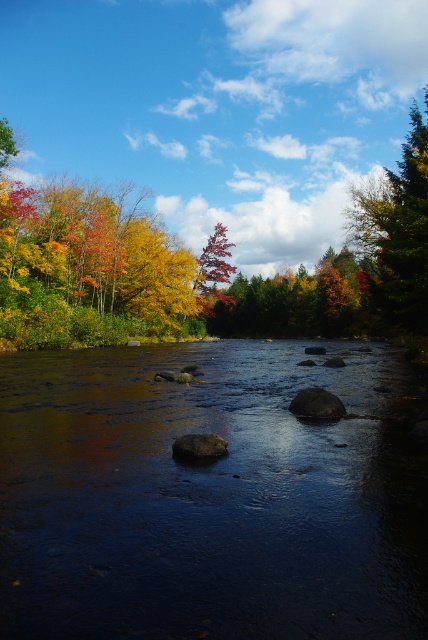
Question: Which point is closer to the camera?

Choices:
 (A) click(x=421, y=163)
 (B) click(x=48, y=336)

Answer: (A)

Question: Which object is positioned closest to the autumn foliage at center?

Choices:
 (A) dark reflective water at center
 (B) green matte tree at upper right
 (C) shiny red tree at center

Answer: (B)

Question: Which of the following is the farthest from the observer?

Choices:
 (A) shiny red tree at center
 (B) green matte tree at upper right

Answer: (A)

Question: Is dark reflective water at center to the left of shiny red tree at center from the viewer's perspective?

Choices:
 (A) yes
 (B) no

Answer: (B)

Question: Considering the relative positions of dark reflective water at center and shiny red tree at center in the image provided, where is dark reflective water at center located with respect to shiny red tree at center?

Choices:
 (A) above
 (B) below

Answer: (B)

Question: Can you confirm if autumn foliage at center is positioned above shiny red tree at center?

Choices:
 (A) no
 (B) yes

Answer: (B)